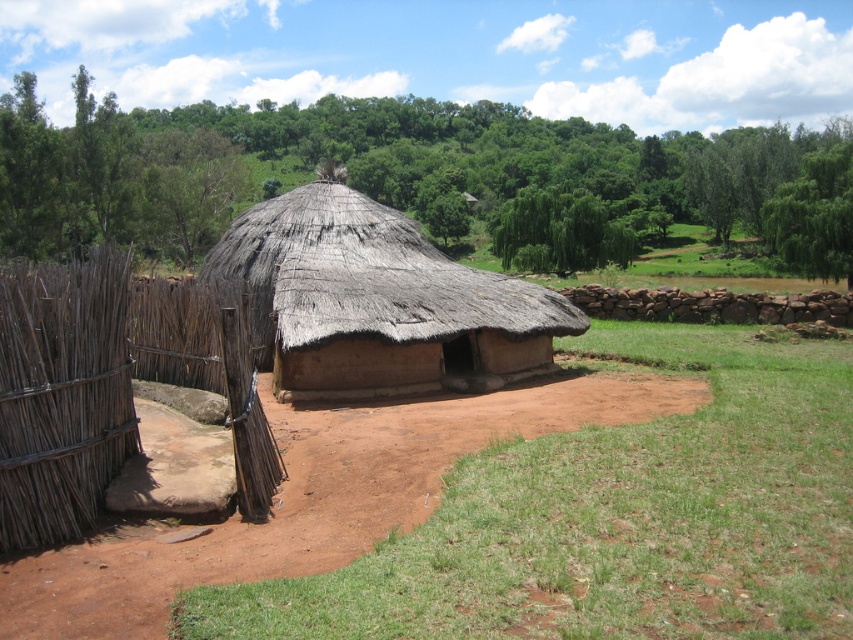
You are a traveler approaching the thatched roof hut and notice the green grass at center and the brown woven fence at left. Which of these two objects occupies a bigger area in the scene?

The green grass at center occupies a bigger area than the brown woven fence at left as it is larger in size.

You are standing in front of the thatched roof hut and want to take a photo. There are two points marked in the scene, point 1 at coordinates point (48, 388) and point 2 at coordinates point (316, 314). Which point is closer to you when you take the photo?

Point (48, 388) is closer to the camera than point (316, 314), so point 1 is closer to you when you take the photo.